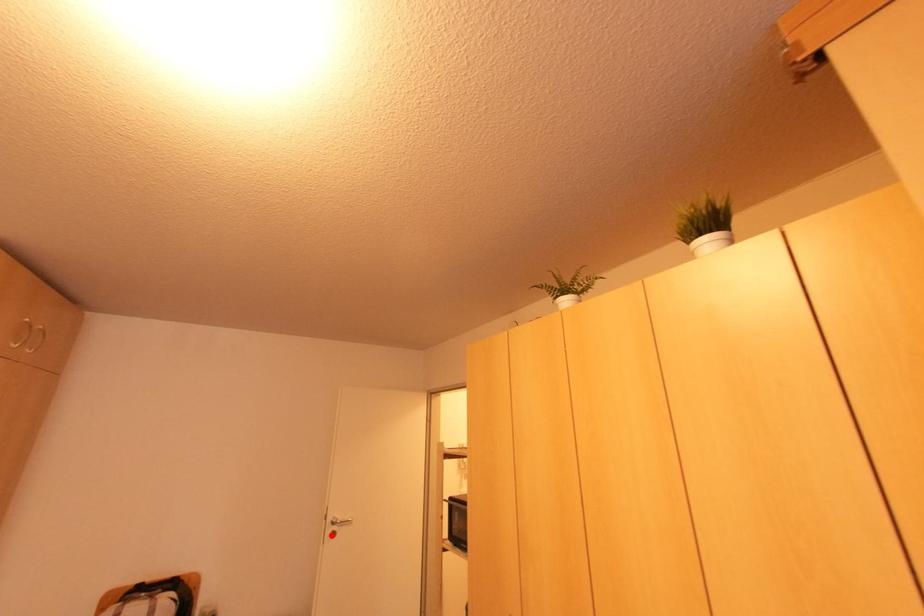
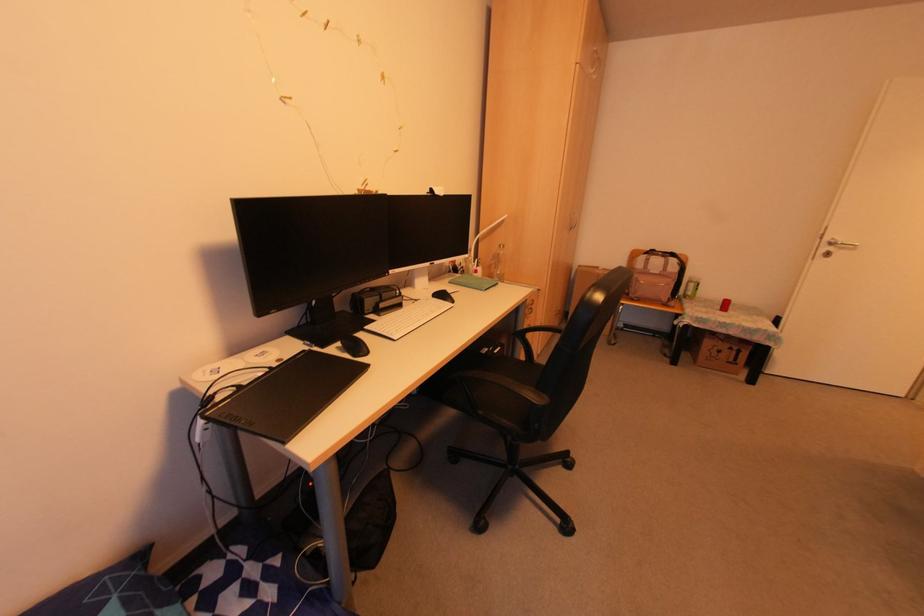
Find the pixel in the second image that matches the highlighted location in the first image.

(825, 254)